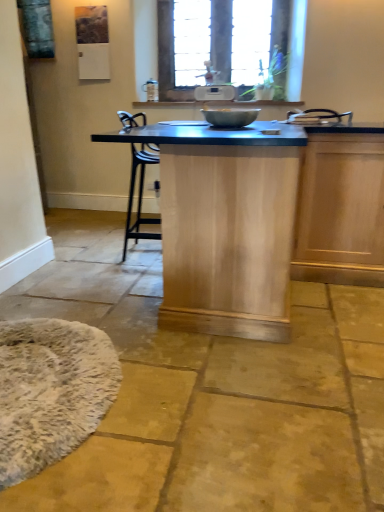
Question: From the image's perspective, does white fluffy mat at lower left appear lower than metallic silver mixing bowl at center?

Choices:
 (A) yes
 (B) no

Answer: (A)

Question: Does white fluffy mat at lower left have a greater height compared to metallic silver mixing bowl at center?

Choices:
 (A) no
 (B) yes

Answer: (B)

Question: Can you confirm if white fluffy mat at lower left is positioned to the left of metallic silver mixing bowl at center?

Choices:
 (A) no
 (B) yes

Answer: (B)

Question: From the image's perspective, is white fluffy mat at lower left above metallic silver mixing bowl at center?

Choices:
 (A) no
 (B) yes

Answer: (A)

Question: Is white fluffy mat at lower left positioned far away from metallic silver mixing bowl at center?

Choices:
 (A) no
 (B) yes

Answer: (B)

Question: Is white fluffy mat at lower left looking in the opposite direction of metallic silver mixing bowl at center?

Choices:
 (A) yes
 (B) no

Answer: (B)

Question: Can you confirm if wooden frame at upper center is positioned to the right of white fluffy mat at lower left?

Choices:
 (A) no
 (B) yes

Answer: (B)

Question: Does wooden frame at upper center have a greater width compared to white fluffy mat at lower left?

Choices:
 (A) yes
 (B) no

Answer: (B)

Question: Does wooden frame at upper center have a lesser height compared to white fluffy mat at lower left?

Choices:
 (A) no
 (B) yes

Answer: (A)

Question: From the image's perspective, is wooden frame at upper center on white fluffy mat at lower left?

Choices:
 (A) yes
 (B) no

Answer: (A)

Question: From a real-world perspective, is wooden frame at upper center positioned over white fluffy mat at lower left based on gravity?

Choices:
 (A) no
 (B) yes

Answer: (B)

Question: Is white fluffy mat at lower left at the back of wooden frame at upper center?

Choices:
 (A) no
 (B) yes

Answer: (A)

Question: Does natural wood table at center have a smaller size compared to metallic silver mixing bowl at center?

Choices:
 (A) no
 (B) yes

Answer: (A)